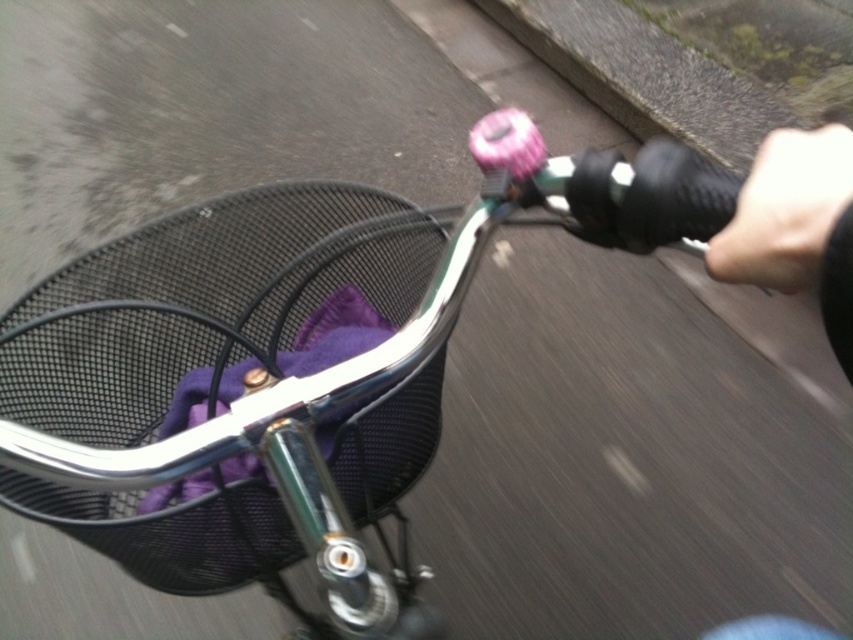
Question: Does black mesh basket at lower left lie behind black leather handlebar grip at right?

Choices:
 (A) no
 (B) yes

Answer: (B)

Question: Among these points, which one is nearest to the camera?

Choices:
 (A) (84, 378)
 (B) (798, 141)

Answer: (B)

Question: Considering the relative positions of black mesh basket at lower left and black leather handlebar grip at right in the image provided, where is black mesh basket at lower left located with respect to black leather handlebar grip at right?

Choices:
 (A) right
 (B) left

Answer: (B)

Question: Is black mesh basket at lower left further to camera compared to black leather handlebar grip at right?

Choices:
 (A) no
 (B) yes

Answer: (B)